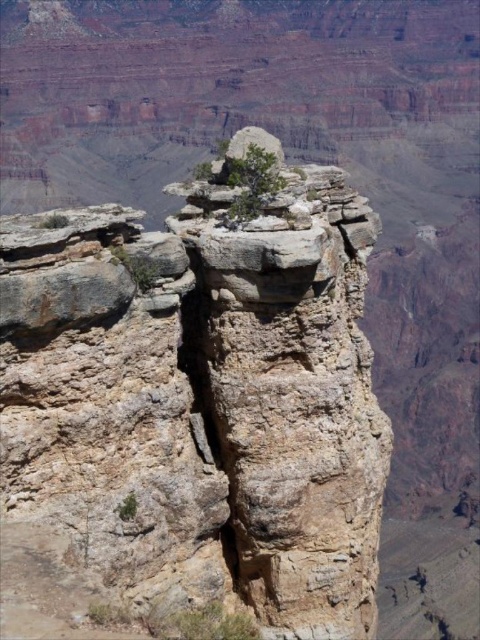
Does rusty stone rock formation at center appear on the left side of green matte tree at center?

No, rusty stone rock formation at center is not to the left of green matte tree at center.

Which is in front, point (335, 422) or point (264, 186)?

Point (264, 186) is in front.

Identify the location of rusty stone rock formation at center. (199, 403).